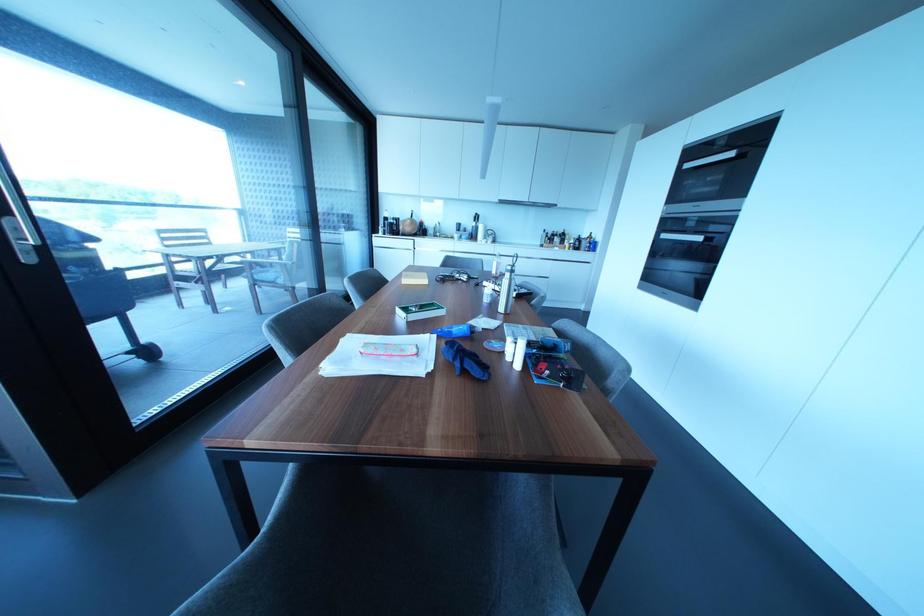
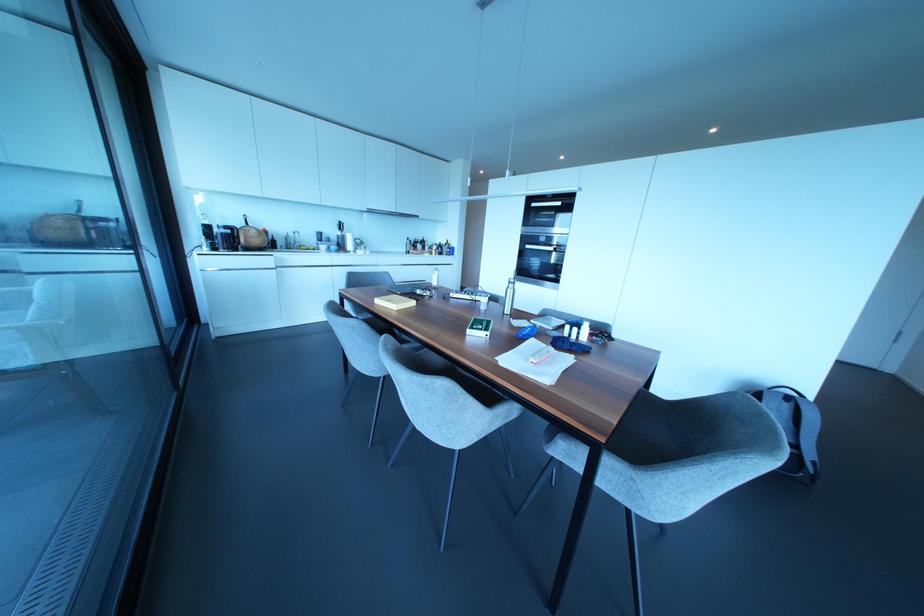
The point at (708, 238) is marked in the first image. Where is the corresponding point in the second image?

(553, 248)